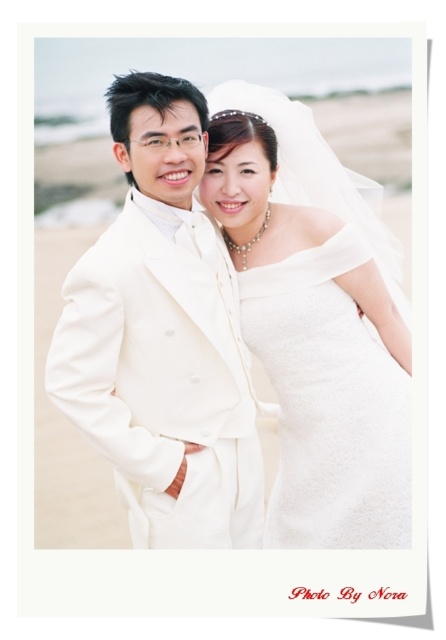
Question: Among these points, which one is farthest from the camera?

Choices:
 (A) (137, 77)
 (B) (345, 424)

Answer: (B)

Question: Is matte white suit at center to the right of satin white dress at center from the viewer's perspective?

Choices:
 (A) yes
 (B) no

Answer: (B)

Question: Does matte white suit at center come in front of satin white dress at center?

Choices:
 (A) yes
 (B) no

Answer: (A)

Question: Among these objects, which one is nearest to the camera?

Choices:
 (A) matte white suit at center
 (B) satin white dress at center

Answer: (A)

Question: Can you confirm if matte white suit at center is positioned to the right of satin white dress at center?

Choices:
 (A) yes
 (B) no

Answer: (B)